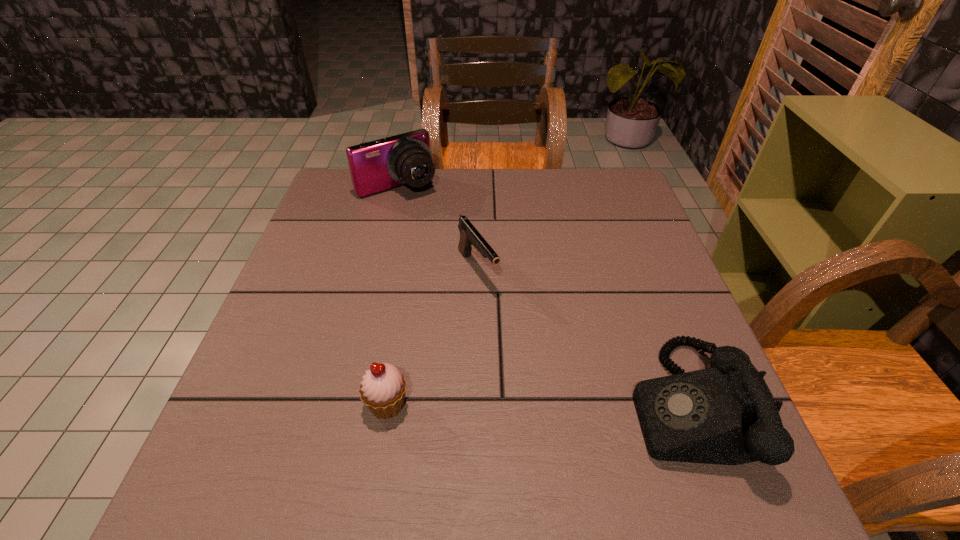
The width and height of the screenshot is (960, 540). Find the location of `free spot located 0.240m at the muzzle of the second farthest object`. free spot located 0.240m at the muzzle of the second farthest object is located at coordinates (546, 372).

Find the location of a particular element. The width and height of the screenshot is (960, 540). vacant area located at the muzzle of the second farthest object is located at coordinates (546, 372).

You are a GUI agent. You are given a task and a screenshot of the screen. Output one action in this format:
    pyautogui.click(x=<x>, y=<y>)
    Task: Click on the free space located 0.190m on the front-facing side of the farthest object
    The image size is (960, 540).
    Given the screenshot: What is the action you would take?
    pyautogui.click(x=445, y=237)

At what (x,y) coordinates should I click in order to perform the action: click on free spot located on the front-facing side of the farthest object. Please return your answer as a coordinate pair (x, y). This screenshot has width=960, height=540. Looking at the image, I should click on 442,232.

Locate an element on the screen. The width and height of the screenshot is (960, 540). vacant space located 0.210m on the front-facing side of the farthest object is located at coordinates (448, 240).

Where is `object situated at the far edge`? object situated at the far edge is located at coordinates (375, 166).

Find the location of `cupcake at the near edge`. cupcake at the near edge is located at coordinates coord(383,388).

Identify the location of telephone at the near edge. The image size is (960, 540). (726, 414).

Where is `object positioned at the left edge`? object positioned at the left edge is located at coordinates (375, 166).

You are a GUI agent. You are given a task and a screenshot of the screen. Output one action in this format:
    pyautogui.click(x=<x>, y=<y>)
    Task: Click on the object that is at the right edge
    This screenshot has height=540, width=960.
    Given the screenshot: What is the action you would take?
    pyautogui.click(x=726, y=414)